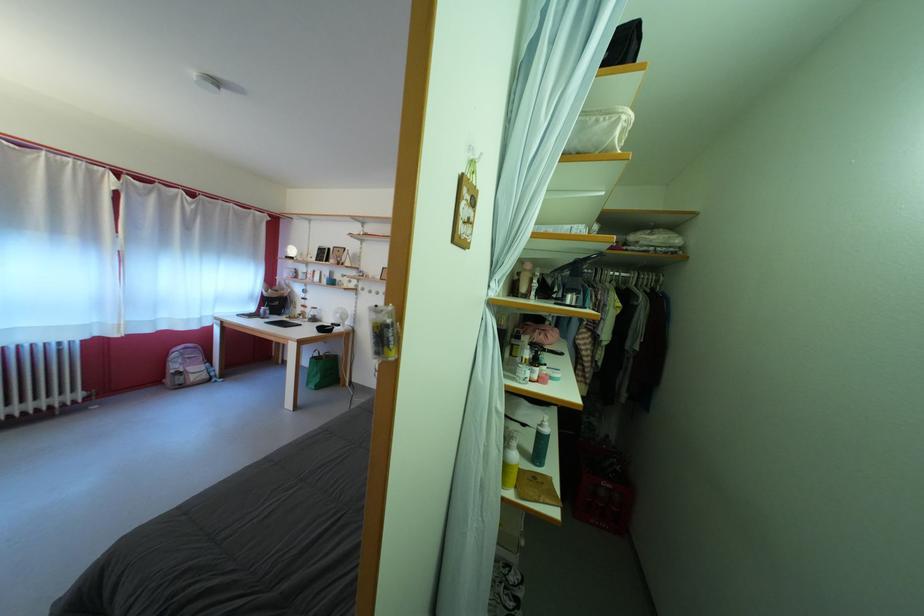
Identify the location of green spray bottle nozzle. This screenshot has height=616, width=924. (383, 331).